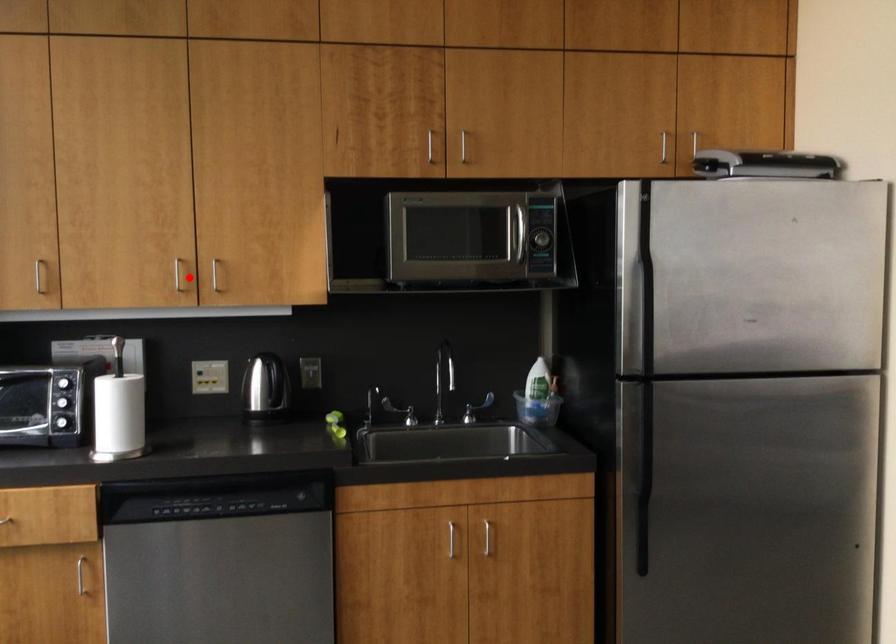
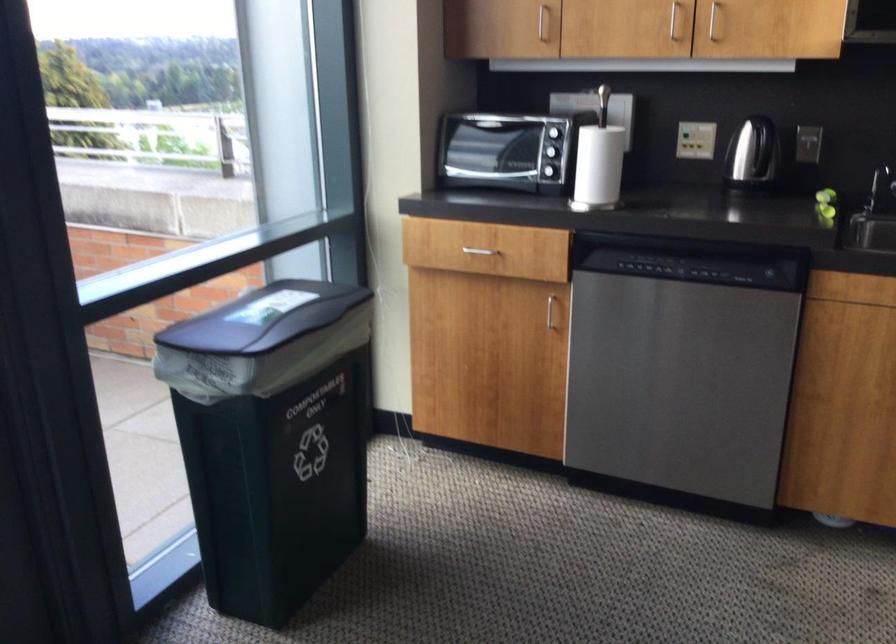
Locate, in the second image, the point that corresponds to the highlighted location in the first image.

(673, 20)